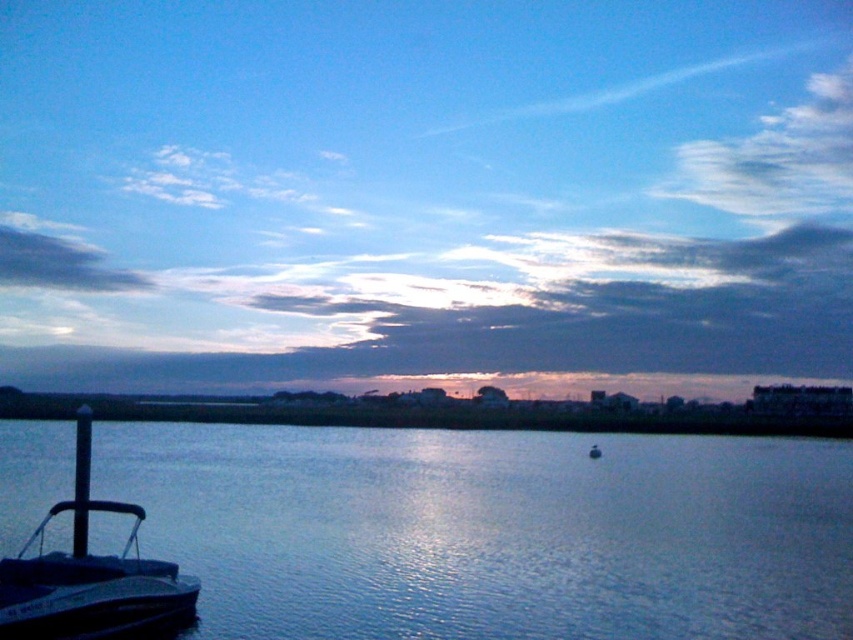
Question: Is blue water at lower left thinner than metallic gray boat at lower left?

Choices:
 (A) yes
 (B) no

Answer: (B)

Question: Is blue water at lower left bigger than metallic gray boat at lower left?

Choices:
 (A) yes
 (B) no

Answer: (A)

Question: Where is blue water at lower left located in relation to metallic gray boat at lower left in the image?

Choices:
 (A) below
 (B) above

Answer: (A)

Question: Which of the following is the closest to the observer?

Choices:
 (A) blue water at lower left
 (B) metallic gray boat at lower left

Answer: (A)